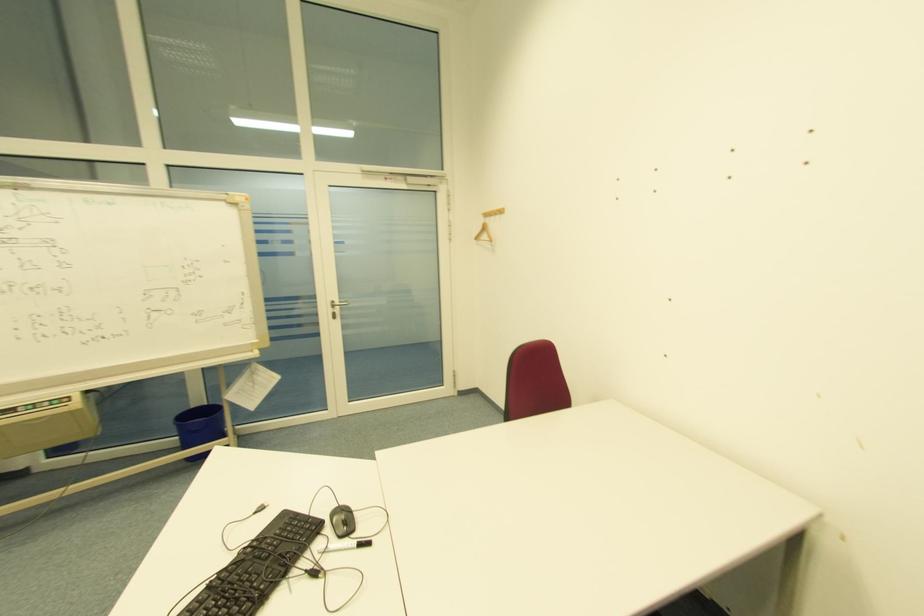
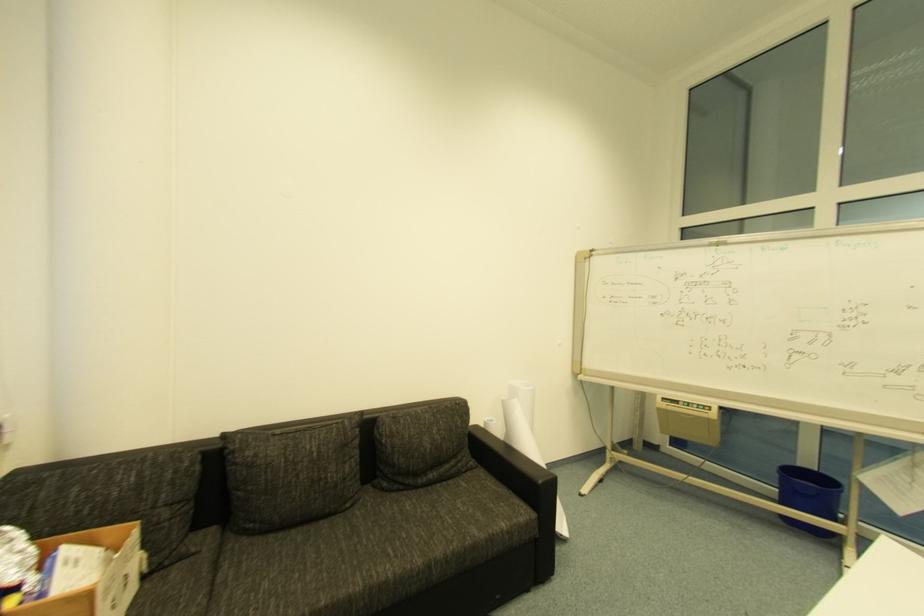
Question: The first image is from the beginning of the video and the second image is from the end. How did the camera likely rotate when shooting the video?

Choices:
 (A) Left
 (B) Right
 (C) Up
 (D) Down

Answer: (A)